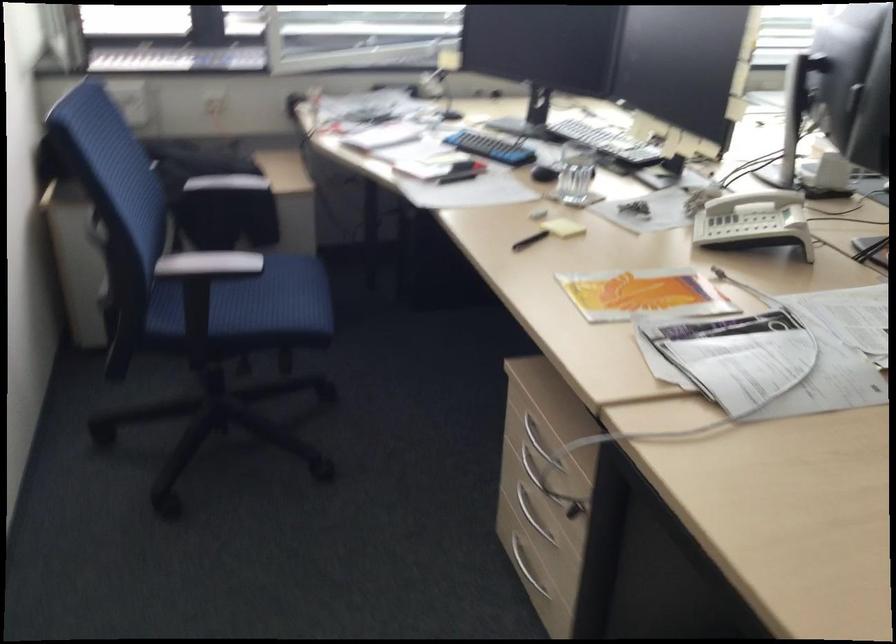
Where would you lift the telephone handset? Please return your answer as a coordinate pair (x, y).

(753, 200)